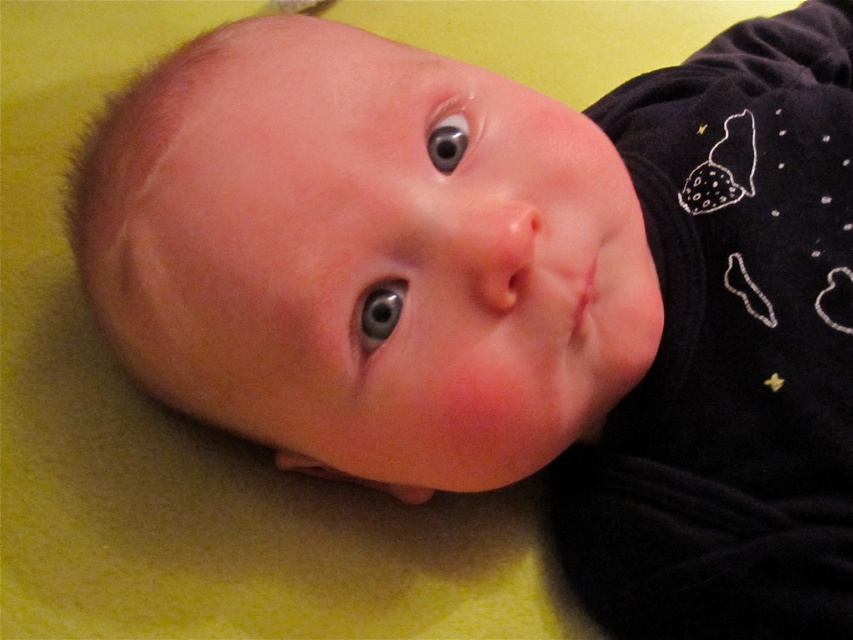
Is point (399, 291) more distant than point (454, 161)?

No, (399, 291) is closer to viewer.

Which is behind, point (395, 289) or point (444, 147)?

The point (444, 147) is more distant.

Locate an element on the screen. The image size is (853, 640). blue glossy eye at center is located at coordinates (376, 314).